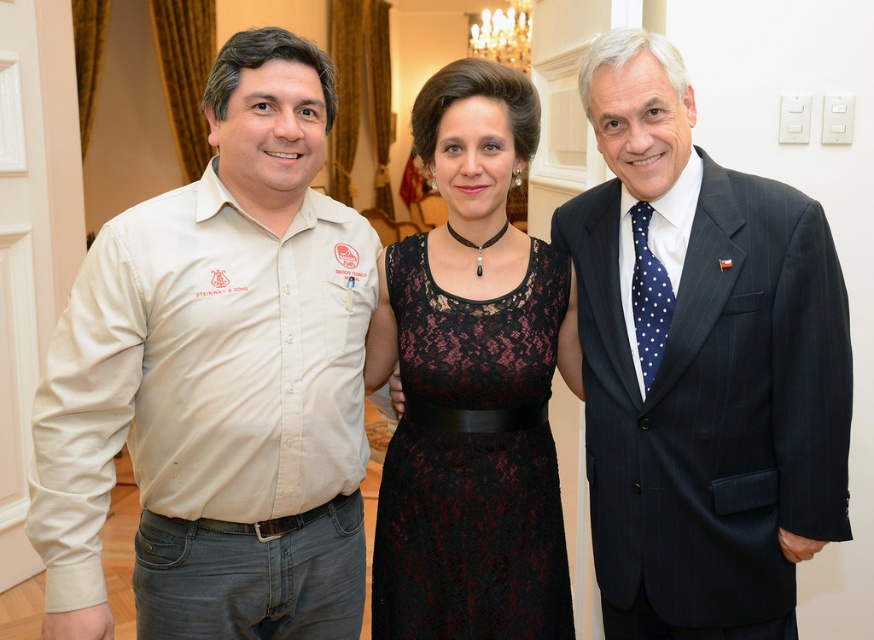
You are standing at the entrance of the room and want to approach both the beige cotton shirt at left and the dark blue pinstripe suit at center. Which individual should you walk towards first to reach them in the shortest path?

You should walk towards the beige cotton shirt at left first because it is closer to you than the dark blue pinstripe suit at center, so reaching it requires a shorter path.

You are planning to take a photo of the beige cotton shirt at left and the black lace dress at center for a fashion magazine. Which of the two garments should you focus on first if you want to highlight their size difference effectively?

The beige cotton shirt at left is bigger than the black lace dress at center, so focusing on the beige cotton shirt at left first would effectively highlight the size difference between the two garments.

Based on the scene description, which object is positioned higher between the dark blue pinstripe suit at center and the black lace dress at center?

The dark blue pinstripe suit at center is positioned higher than the black lace dress at center according to the description.